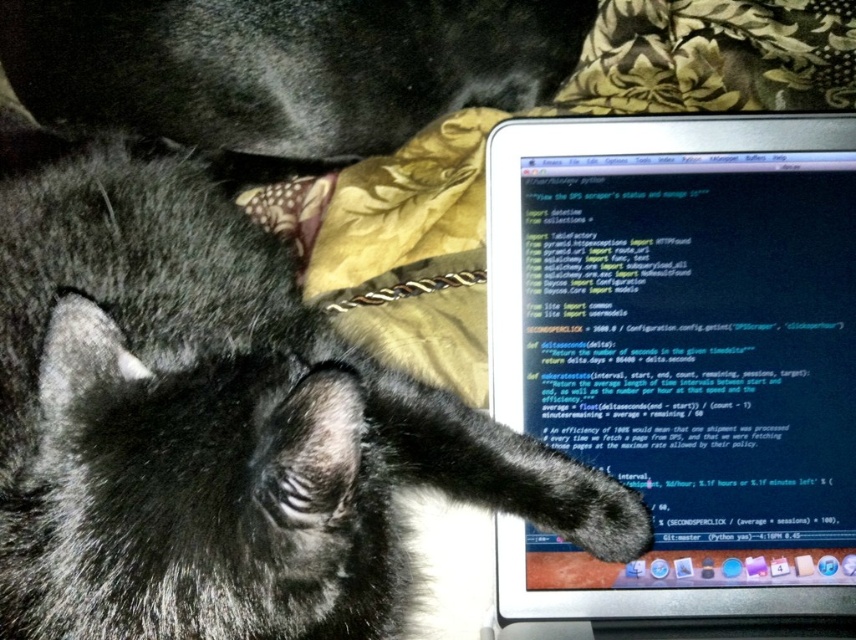
Consider the image. Is matte black laptop at upper right behind black fur cat at upper left?

No, it is in front of black fur cat at upper left.

Consider the image. Who is positioned more to the left, matte black laptop at upper right or black fur cat at upper left?

black fur cat at upper left is more to the left.

Is point (785, 403) farther from viewer compared to point (294, 58)?

No, it is not.

What are the coordinates of `matte black laptop at upper right` in the screenshot? It's located at (681, 355).

Between black fur cat at center and matte black laptop at upper right, which one is positioned higher?

black fur cat at center

Is point (164, 236) farther from camera compared to point (503, 208)?

Yes, it is.

At what (x,y) coordinates should I click in order to perform the action: click on black fur cat at center. Please return your answer as a coordinate pair (x, y). Looking at the image, I should click on (214, 420).

Describe the element at coordinates (214, 420) in the screenshot. Image resolution: width=856 pixels, height=640 pixels. I see `black fur cat at center` at that location.

Which is in front, point (296, 307) or point (312, 141)?

Point (296, 307) is in front.

Where is `black fur cat at center`? The width and height of the screenshot is (856, 640). black fur cat at center is located at coordinates (214, 420).